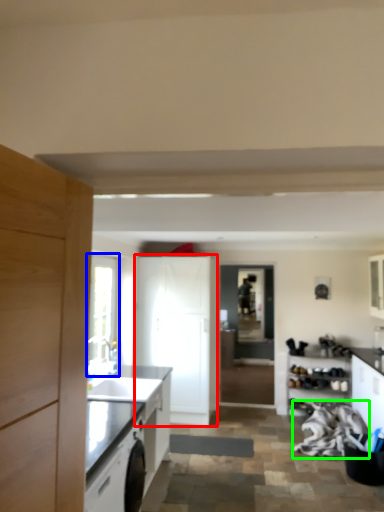
Question: Which object is positioned farthest from cabinetry (highlighted by a red box)? Select from window (highlighted by a blue box) and material (highlighted by a green box).

Choices:
 (A) window
 (B) material

Answer: (B)